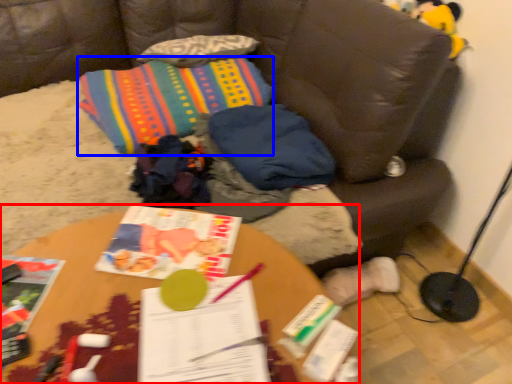
Question: Which object is closer to the camera taking this photo, table (highlighted by a red box) or throw pillow (highlighted by a blue box)?

Choices:
 (A) table
 (B) throw pillow

Answer: (A)